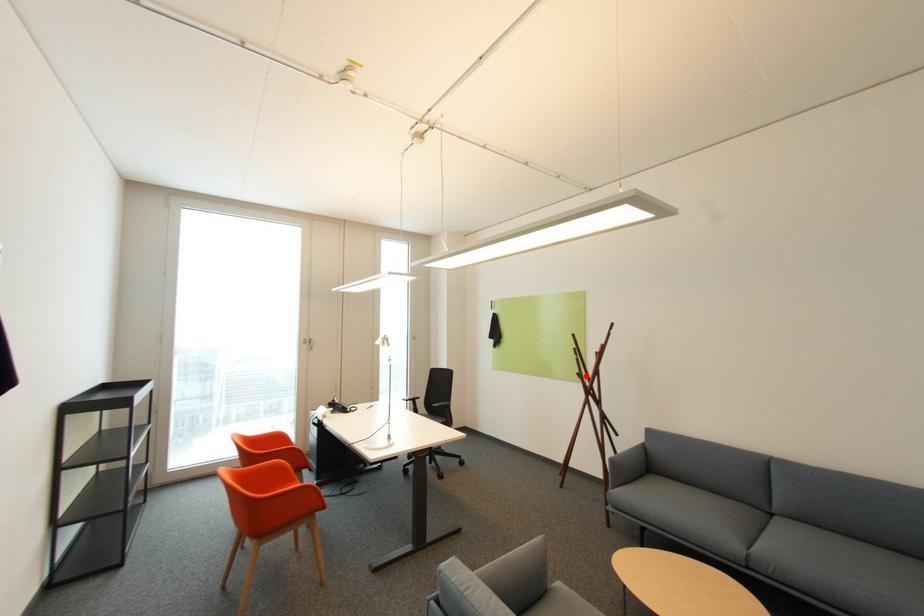
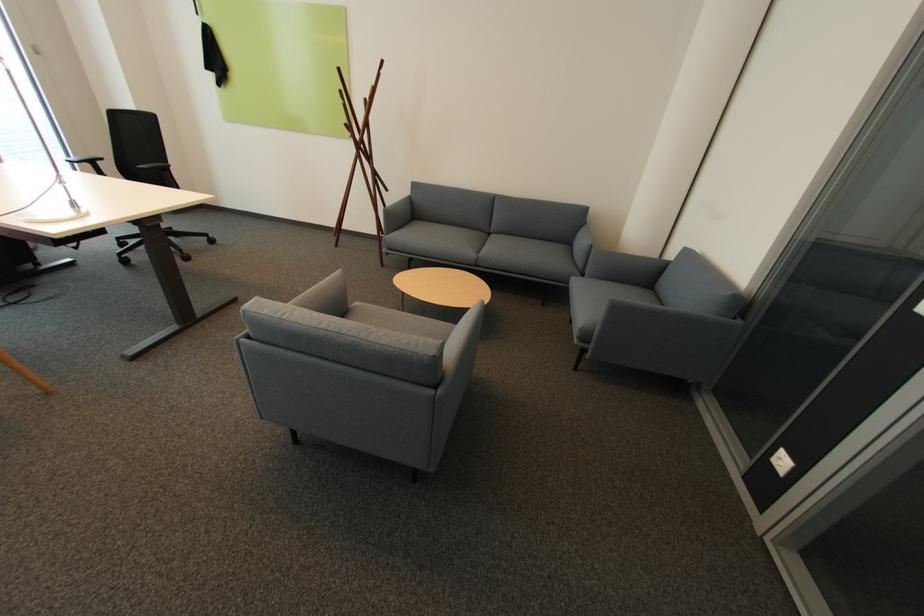
Where in the second image is the point corresponding to the highlighted location from the first image?

(355, 126)